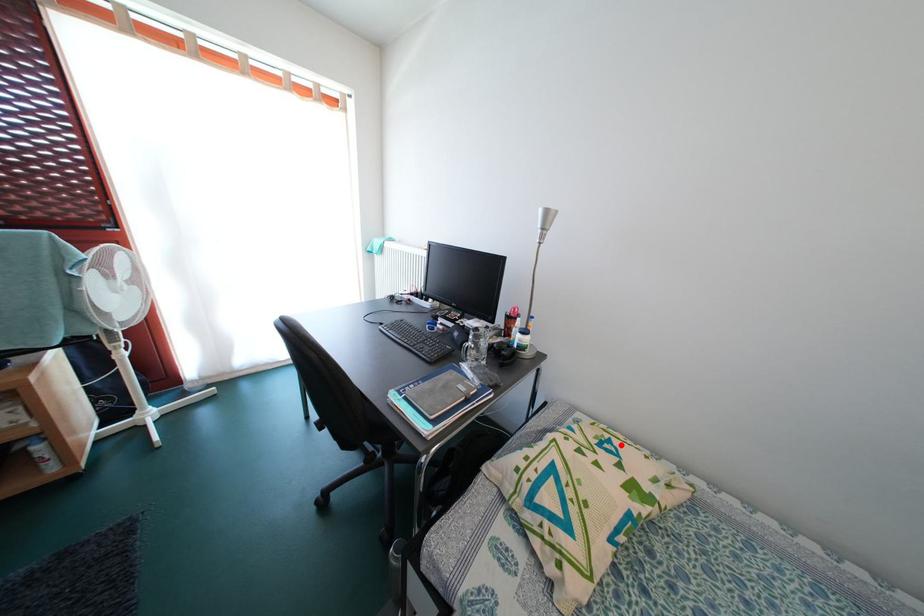
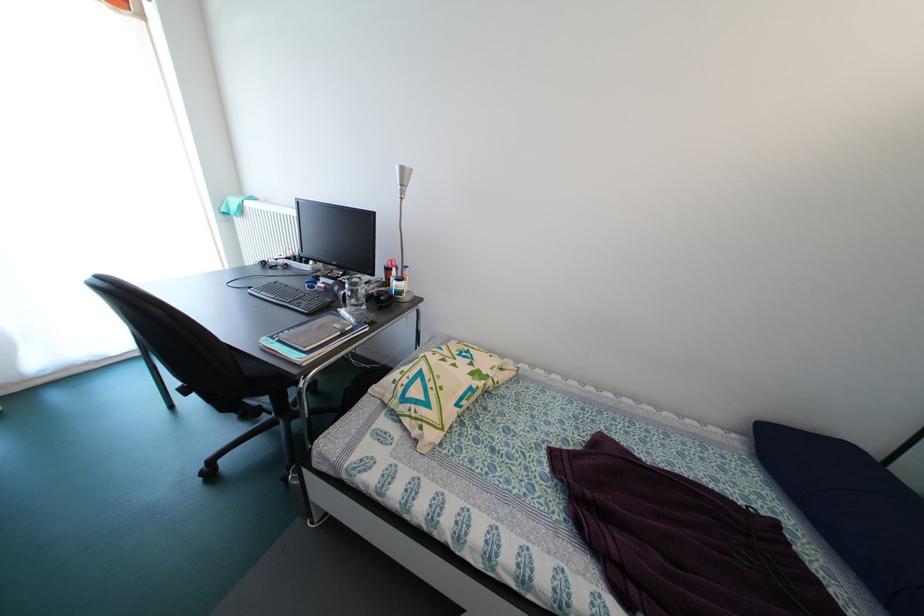
Locate, in the second image, the point that corresponds to the highlighted location in the first image.

(479, 355)